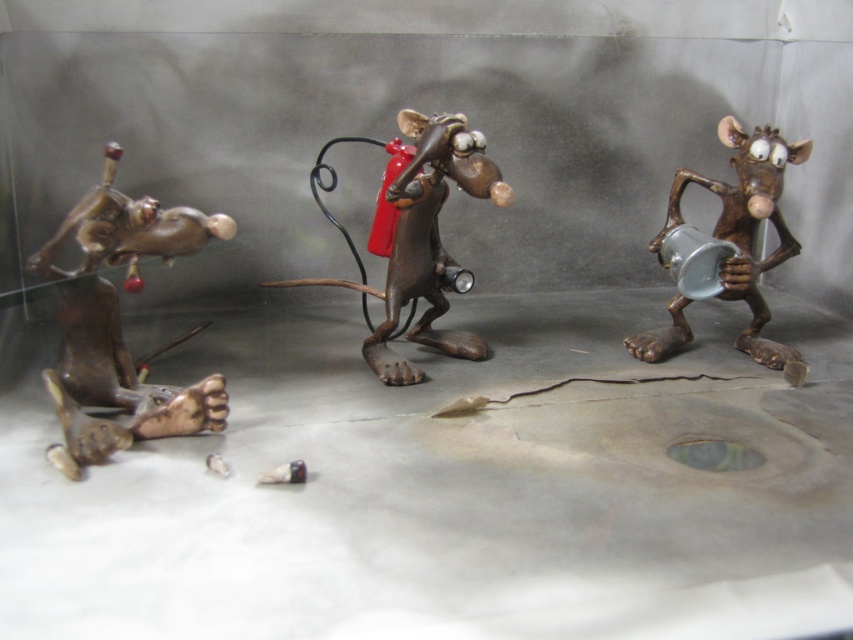
Which is more to the left, bronze/metallic mouse at center or bronze figurine at right?

From the viewer's perspective, bronze/metallic mouse at center appears more on the left side.

Where is `bronze/metallic mouse at center`? Image resolution: width=853 pixels, height=640 pixels. bronze/metallic mouse at center is located at coordinates (422, 237).

The height and width of the screenshot is (640, 853). I want to click on bronze/metallic mouse at center, so click(422, 237).

Is point (74, 312) behind point (724, 116)?

No.

Is bronze statue at left positioned in front of bronze figurine at right?

Yes, it is.

This screenshot has height=640, width=853. What do you see at coordinates (119, 323) in the screenshot?
I see `bronze statue at left` at bounding box center [119, 323].

Find the location of a particular element. The width and height of the screenshot is (853, 640). bronze statue at left is located at coordinates (119, 323).

Is bronze statue at left above bronze/metallic mouse at center?

Actually, bronze statue at left is below bronze/metallic mouse at center.

Does bronze statue at left have a smaller size compared to bronze/metallic mouse at center?

Indeed, bronze statue at left has a smaller size compared to bronze/metallic mouse at center.

Who is more distant from viewer, (x=117, y=237) or (x=460, y=118)?

Point (x=460, y=118)

The height and width of the screenshot is (640, 853). Find the location of `bronze statue at left`. bronze statue at left is located at coordinates (119, 323).